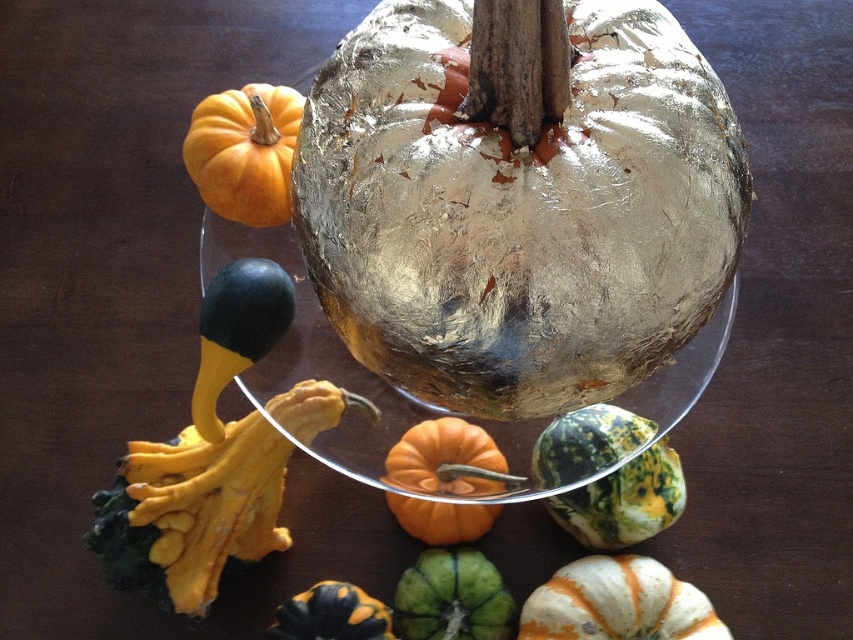
You are an artist setting up a still life. You have a green speckled gourd at center and a green matte gourd at center. Which one do you need to move if you want to make the one behind more visible?

You need to move the green speckled gourd at center because it is currently in front of the green matte gourd at center, obscuring its view.

In the scene shown: You are setting up a display for a fall festival and need to place a decorative item between the green speckled gourd at center and the orange and black striped gourd at lower center. Based on their positions, where should you place the item to ensure it is between them?

The green speckled gourd at center is to the right of the orange and black striped gourd at lower center, so placing the decorative item between them would require positioning it to the right of the orange and black striped gourd at lower center and to the left of the green speckled gourd at center.

You are setting up a display and need to know the position of the green speckled gourd at center and orange and black striped gourd at lower center. Which one is placed higher in the arrangement?

The green speckled gourd at center is placed higher than the orange and black striped gourd at lower center.